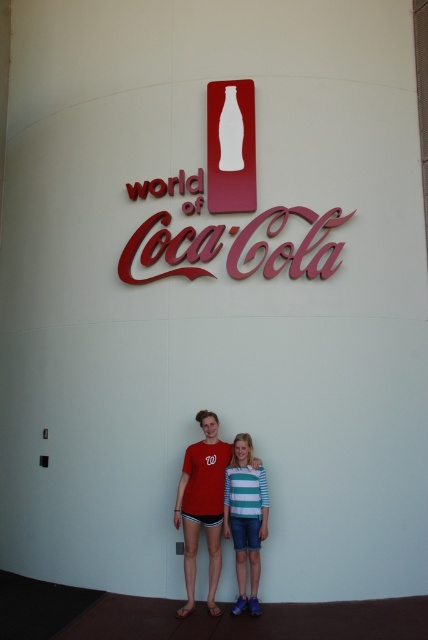
Question: Which point is closer to the camera?

Choices:
 (A) (216, 612)
 (B) (232, 497)

Answer: (A)

Question: Which point is closer to the camera?

Choices:
 (A) (205, 438)
 (B) (252, 568)

Answer: (B)

Question: Which point is closer to the camera?

Choices:
 (A) red cotton t-shirt at center
 (B) striped cotton shirt at center

Answer: (A)

Question: Is red cotton t-shirt at center positioned at the back of striped cotton shirt at center?

Choices:
 (A) no
 (B) yes

Answer: (A)

Question: Is red cotton t-shirt at center bigger than striped cotton shirt at center?

Choices:
 (A) no
 (B) yes

Answer: (B)

Question: Does red cotton t-shirt at center have a smaller size compared to striped cotton shirt at center?

Choices:
 (A) yes
 (B) no

Answer: (B)